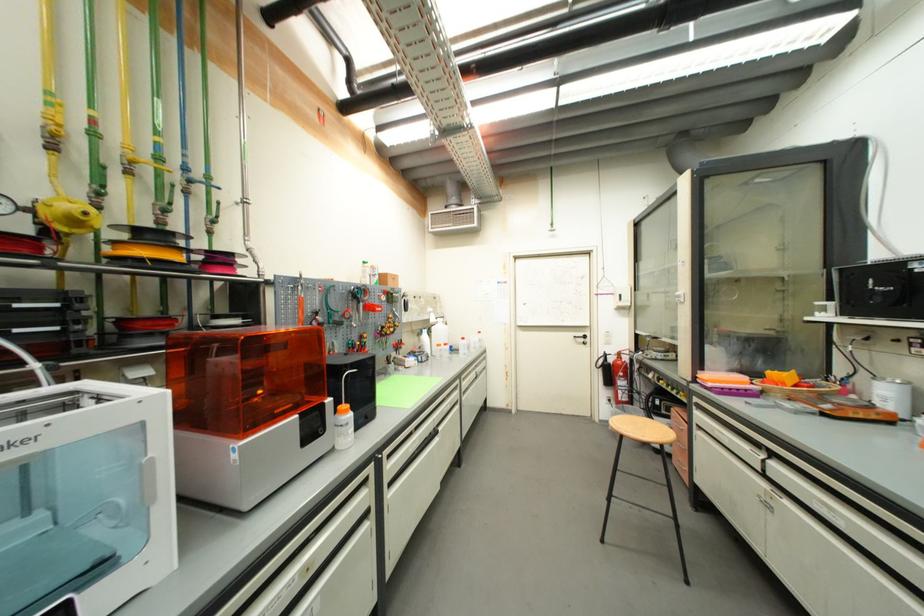
Locate an element on the screen. This screenshot has width=924, height=616. yellow valve handle is located at coordinates (66, 222).